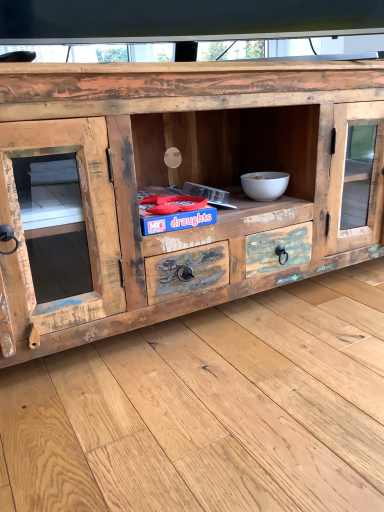
Question: Is rustic wood chest of drawers at center to the left or to the right of white matte bowl at center-right in the image?

Choices:
 (A) right
 (B) left

Answer: (B)

Question: From a real-world perspective, relative to white matte bowl at center-right, is rustic wood chest of drawers at center vertically above or below?

Choices:
 (A) above
 (B) below

Answer: (A)

Question: Considering their positions, is rustic wood chest of drawers at center located in front of or behind white matte bowl at center-right?

Choices:
 (A) front
 (B) behind

Answer: (A)

Question: Would you say white matte bowl at center-right is to the left or to the right of rustic wood chest of drawers at center in the picture?

Choices:
 (A) right
 (B) left

Answer: (A)

Question: From a real-world perspective, is white matte bowl at center-right positioned above or below rustic wood chest of drawers at center?

Choices:
 (A) below
 (B) above

Answer: (A)

Question: Choose the correct answer: Is white matte bowl at center-right inside rustic wood chest of drawers at center or outside it?

Choices:
 (A) inside
 (B) outside

Answer: (A)

Question: Relative to rustic wood chest of drawers at center, is white matte bowl at center-right in front or behind?

Choices:
 (A) behind
 (B) front

Answer: (A)